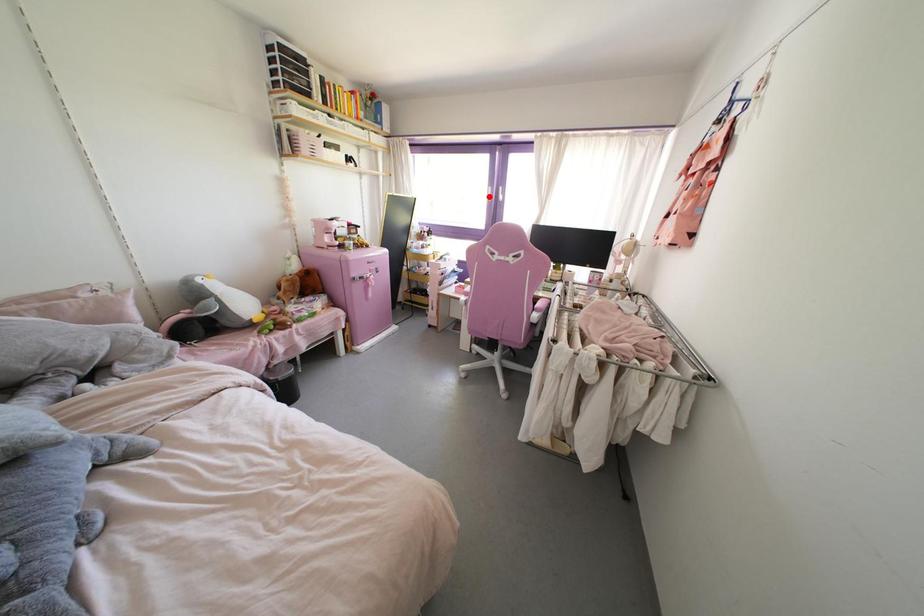
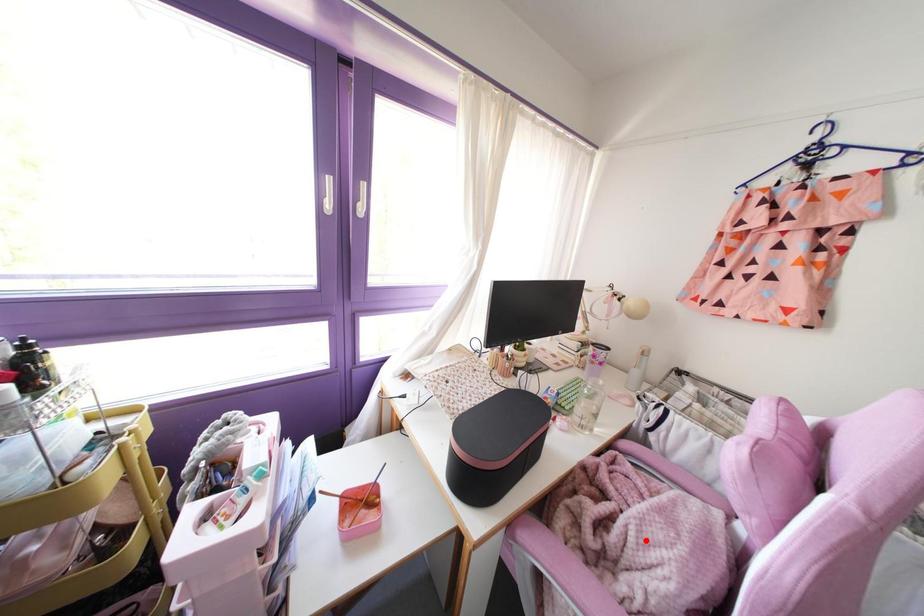
I am providing you with two images of the same scene from different viewpoints. A red point is marked on the first image and another point is marked on the second image. Is the marked point in image1 the same physical position as the marked point in image2?

No